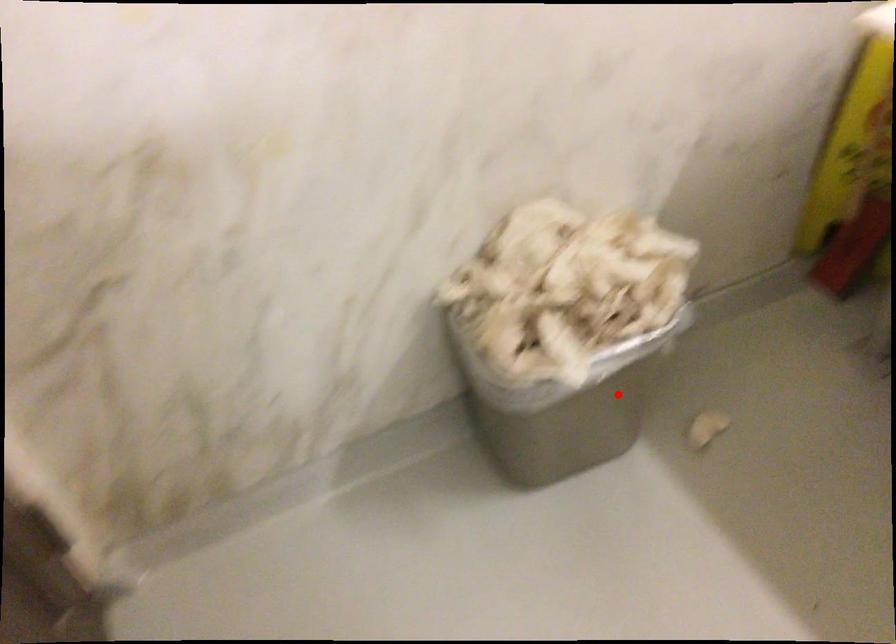
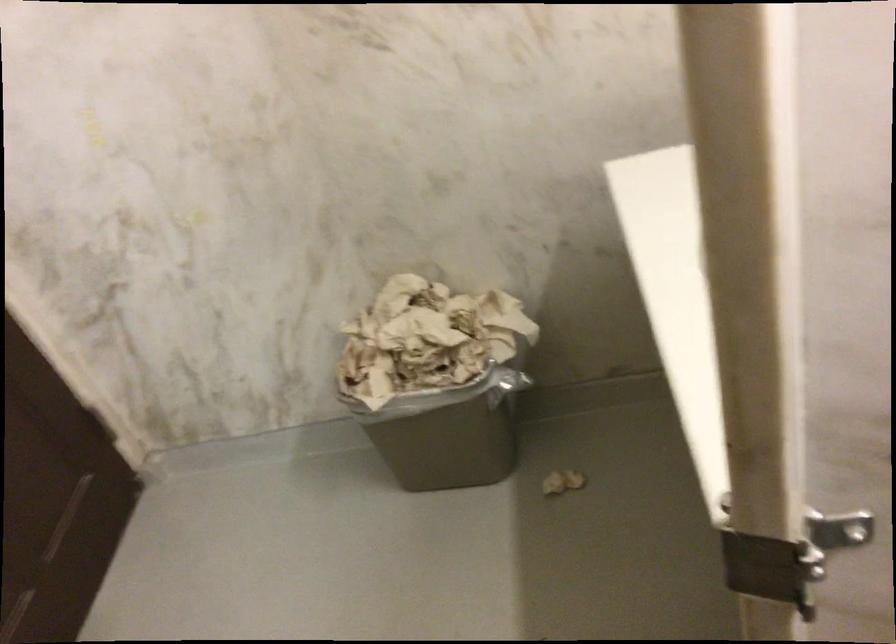
Question: I am providing you with two images of the same scene from different viewpoints. In image1, a red point is highlighted. Considering the same 3D point in image2, which of the following is correct?

Choices:
 (A) It is closer
 (B) It is farther

Answer: (B)